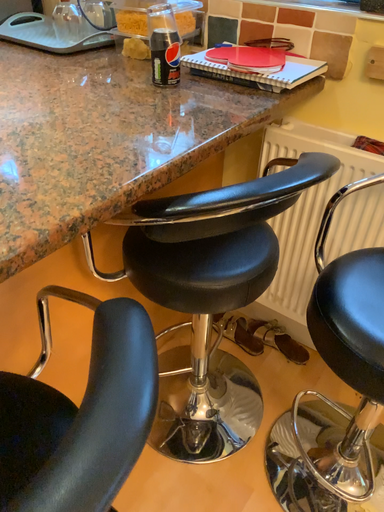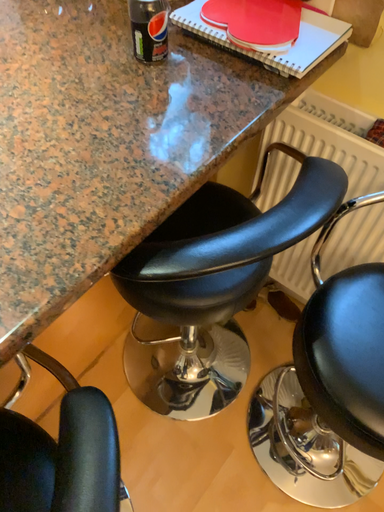
Question: Which way did the camera rotate in the video?

Choices:
 (A) rotated downward
 (B) rotated upward

Answer: (A)